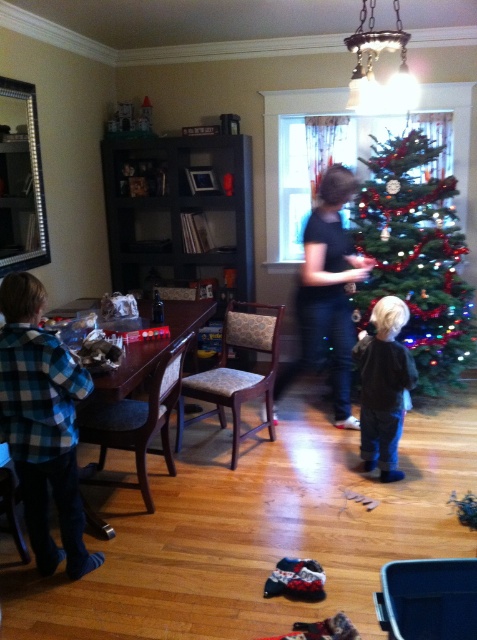
Consider the image. You are a guest at this festive gathering and want to place a tall decoration on the table. Which object, the green shiny christmas tree at right or the black matte shirt at center, would you need to move to make space?

The green shiny christmas tree at right has a greater height compared to the black matte shirt at center, so you would need to move the green shiny christmas tree at right to make space for the tall decoration.

You are a guest at this festive gathering and need to retrieve your black velvet jacket at center. However, there is a green shiny christmas tree at right in the way. Can you easily reach your jacket without moving the tree?

The green shiny christmas tree at right is located above the black velvet jacket at center, meaning the tree is positioned higher up and not blocking the path. Therefore, you can easily reach the black velvet jacket at center without moving the tree.

You are helping organize the gifts on the table and notice two items on the table. Which one is positioned higher up between the black matte shirt at center and the black velvet jacket at center?

The black matte shirt at center is positioned higher up as it is located above the black velvet jacket at center.